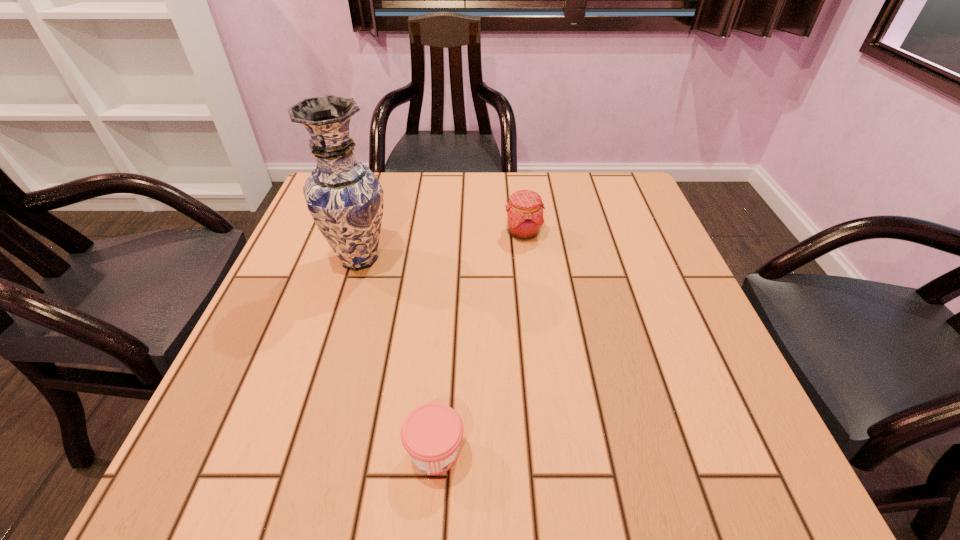
Where is `free space between the left jam and the leftmost object`? The height and width of the screenshot is (540, 960). free space between the left jam and the leftmost object is located at coordinates (397, 355).

This screenshot has height=540, width=960. In order to click on vacant area that lies between the left jam and the tallest object in this screenshot , I will do `click(397, 355)`.

Locate an element on the screen. This screenshot has width=960, height=540. free space between the vase and the nearer jam is located at coordinates (397, 355).

This screenshot has height=540, width=960. What are the coordinates of `vacant region between the second tallest object and the left jam` in the screenshot? It's located at (479, 342).

Locate an element on the screen. The height and width of the screenshot is (540, 960). blank region between the vase and the right jam is located at coordinates [x=442, y=246].

The width and height of the screenshot is (960, 540). Identify the location of vacant space in between the shortest object and the right jam. (479, 342).

Locate an element on the screen. unoccupied position between the left jam and the tallest object is located at coordinates (397, 355).

Locate an element on the screen. vacant space that is in between the taller jam and the nearest object is located at coordinates (479, 342).

Find the location of a particular element. The width and height of the screenshot is (960, 540). free space between the shortest object and the tallest object is located at coordinates (397, 355).

Identify the location of object that stands as the closest to the left jam. The width and height of the screenshot is (960, 540). (344, 197).